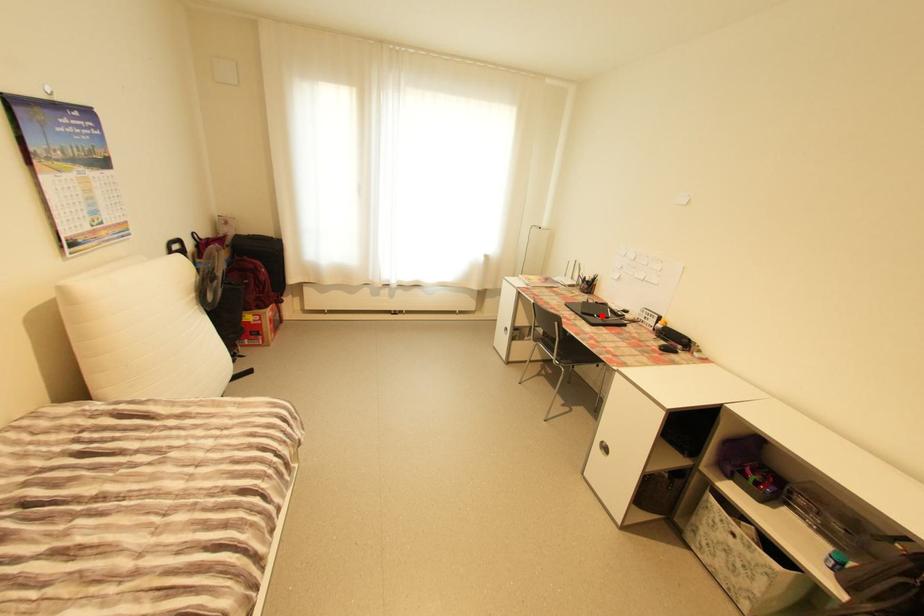
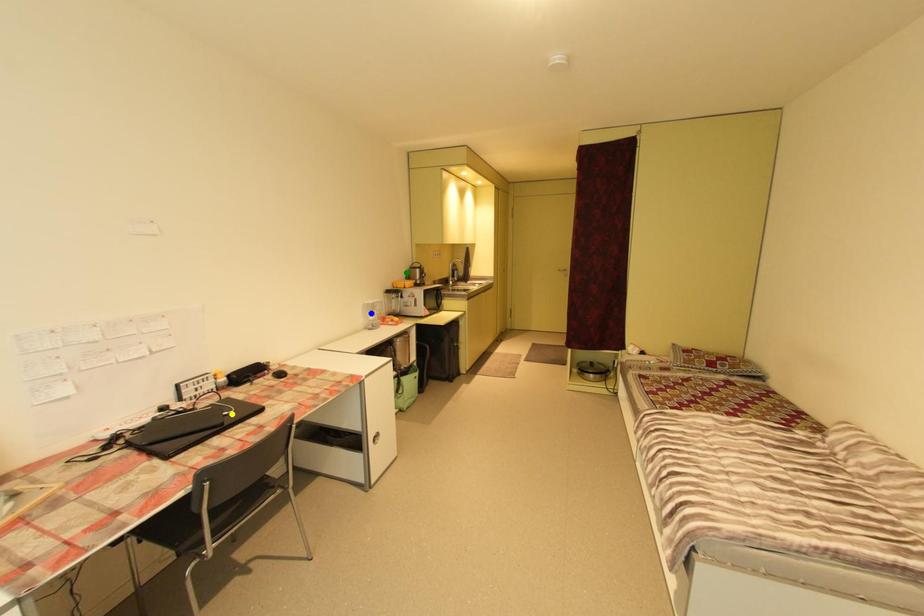
Question: I am providing you with two images of the same scene from different viewpoints. A red point is marked on the first image. You are given multiple points on the second image. Which mark in image 2 goes with the point in image 1?

Choices:
 (A) green point
 (B) yellow point
 (C) blue point

Answer: (B)